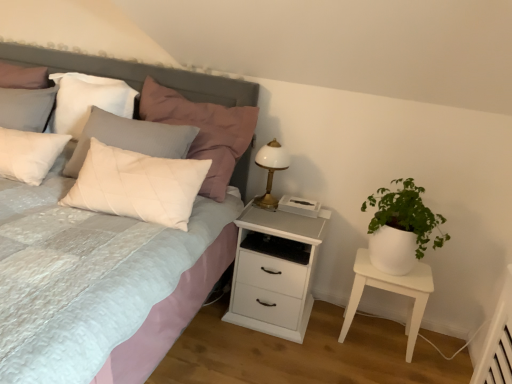
Question: Considering the positions of white quilted pillow at upper left, the first pillow viewed from the left, and white quilted pillow at upper left, the 1th pillow positioned from the right, in the image, is white quilted pillow at upper left, the first pillow viewed from the left, bigger or smaller than white quilted pillow at upper left, the 1th pillow positioned from the right,?

Choices:
 (A) big
 (B) small

Answer: (B)

Question: Based on their positions, is white quilted pillow at upper left, arranged as the 2th pillow when viewed from the right, located to the left or right of white quilted pillow at upper left, the 1th pillow positioned from the right?

Choices:
 (A) right
 (B) left

Answer: (B)

Question: Based on their relative distances, which object is nearer to the white quilted pillow at upper left, arranged as the 2th pillow when viewed from the right?

Choices:
 (A) white glossy bedside lamp at upper right
 (B) white matte nightstand at center
 (C) white quilted fabric bed at upper left
 (D) white matte table at right
 (E) matte gray headboard at upper left

Answer: (C)

Question: Estimate the real-world distances between objects in this image. Which object is closer to the white quilted fabric bed at upper left?

Choices:
 (A) white matte table at right
 (B) white quilted pillow at upper left, the first pillow viewed from the left
 (C) white matte nightstand at center
 (D) white quilted pillow at upper left, which ranks as the 2th pillow in left-to-right order
 (E) white glossy bedside lamp at upper right

Answer: (B)